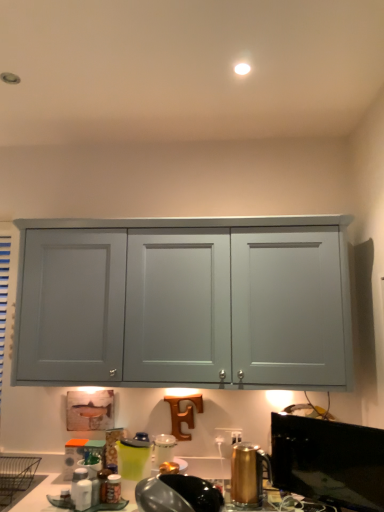
Question: Does green plastic pitcher at lower center, the 3th appliance when ordered from right to left, contain matte plastic container at lower left, which appears as the 1th appliance when viewed from the back?

Choices:
 (A) yes
 (B) no

Answer: (B)

Question: From the image's perspective, is green plastic pitcher at lower center, the 3th appliance when ordered from right to left, over matte plastic container at lower left, which appears as the 1th appliance when viewed from the back?

Choices:
 (A) yes
 (B) no

Answer: (A)

Question: From a real-world perspective, is green plastic pitcher at lower center, the second appliance positioned from the back, physically above matte plastic container at lower left, which appears as the 1th appliance when viewed from the back?

Choices:
 (A) yes
 (B) no

Answer: (A)

Question: Is green plastic pitcher at lower center, the 3th appliance when ordered from right to left, bigger than matte plastic container at lower left, the fourth appliance viewed from the right?

Choices:
 (A) no
 (B) yes

Answer: (B)

Question: Is green plastic pitcher at lower center, the 3th appliance when ordered from right to left, closer to the viewer compared to matte plastic container at lower left, which appears as the 1th appliance when viewed from the back?

Choices:
 (A) no
 (B) yes

Answer: (B)

Question: Looking at their shapes, would you say black glossy window screen at lower right is wider or thinner than gold metallic kettle at lower right, the 4th appliance in the left-to-right sequence?

Choices:
 (A) wide
 (B) thin

Answer: (B)

Question: Is black glossy window screen at lower right inside or outside of gold metallic kettle at lower right, the 2th appliance viewed from the front?

Choices:
 (A) outside
 (B) inside

Answer: (A)

Question: In terms of size, does black glossy window screen at lower right appear bigger or smaller than gold metallic kettle at lower right, the 2th appliance viewed from the front?

Choices:
 (A) big
 (B) small

Answer: (A)

Question: From a real-world perspective, is black glossy window screen at lower right above or below gold metallic kettle at lower right, the 4th appliance in the left-to-right sequence?

Choices:
 (A) below
 (B) above

Answer: (B)

Question: Is matte plastic container at lower left, acting as the fourth appliance starting from the front, inside the boundaries of green plastic pitcher at lower center, the second appliance positioned from the back, or outside?

Choices:
 (A) outside
 (B) inside

Answer: (A)

Question: Is matte plastic container at lower left, which appears as the 1th appliance when viewed from the back, taller or shorter than green plastic pitcher at lower center, which is the third appliance from front to back?

Choices:
 (A) tall
 (B) short

Answer: (B)

Question: From a real-world perspective, is matte plastic container at lower left, which appears as the 1th appliance when viewed from the back, positioned above or below green plastic pitcher at lower center, the second appliance positioned from the back?

Choices:
 (A) below
 (B) above

Answer: (A)

Question: In the image, is matte plastic container at lower left, the fourth appliance viewed from the right, on the left side or the right side of green plastic pitcher at lower center, the 3th appliance when ordered from right to left?

Choices:
 (A) right
 (B) left

Answer: (B)

Question: From a real-world perspective, is matte plastic container at lower left, arranged as the 1th appliance when viewed from the left, above or below black glossy window screen at lower right?

Choices:
 (A) below
 (B) above

Answer: (A)

Question: Does point (72, 439) appear closer or farther from the camera than point (304, 441)?

Choices:
 (A) farther
 (B) closer

Answer: (A)